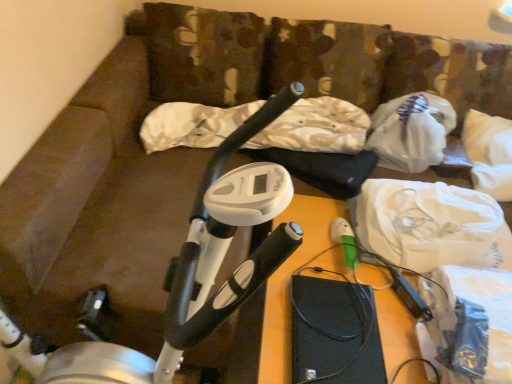
Question: From a real-world perspective, is white plastic stationary bicycle at left physically above white plastic bag at upper right?

Choices:
 (A) yes
 (B) no

Answer: (A)

Question: Considering the relative positions of white plastic stationary bicycle at left and white plastic bag at upper right in the image provided, is white plastic stationary bicycle at left to the right of white plastic bag at upper right from the viewer's perspective?

Choices:
 (A) yes
 (B) no

Answer: (B)

Question: From the image's perspective, is white plastic stationary bicycle at left on white plastic bag at upper right?

Choices:
 (A) yes
 (B) no

Answer: (B)

Question: From the image's perspective, does white plastic stationary bicycle at left appear lower than white plastic bag at upper right?

Choices:
 (A) no
 (B) yes

Answer: (B)

Question: Can you confirm if white plastic stationary bicycle at left is bigger than white plastic bag at upper right?

Choices:
 (A) yes
 (B) no

Answer: (A)

Question: Does white plastic stationary bicycle at left appear on the left side of white plastic bag at upper right?

Choices:
 (A) yes
 (B) no

Answer: (A)

Question: Does white fabric at upper right turn towards white plastic stationary bicycle at left?

Choices:
 (A) yes
 (B) no

Answer: (B)

Question: Does white fabric at upper right have a lesser width compared to white plastic stationary bicycle at left?

Choices:
 (A) yes
 (B) no

Answer: (A)

Question: Is white fabric at upper right taller than white plastic stationary bicycle at left?

Choices:
 (A) yes
 (B) no

Answer: (B)

Question: From a real-world perspective, is white fabric at upper right over white plastic stationary bicycle at left?

Choices:
 (A) yes
 (B) no

Answer: (B)

Question: Is white fabric at upper right positioned with its back to white plastic stationary bicycle at left?

Choices:
 (A) yes
 (B) no

Answer: (B)

Question: Does white fabric at upper right contain white plastic stationary bicycle at left?

Choices:
 (A) yes
 (B) no

Answer: (B)

Question: Is white fabric at upper right located within white plastic bag at upper right?

Choices:
 (A) yes
 (B) no

Answer: (B)